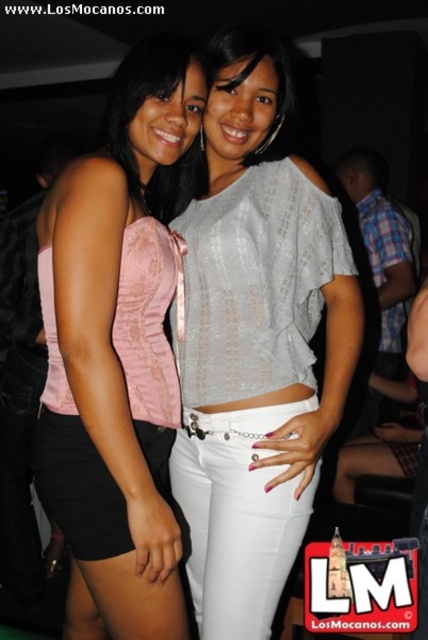
You are at a party and want to take a photo of both the light gray lace blouse at center and the pink satin top at left. Since you can only focus on one person at a time, which one should you aim the camera at to ensure the other is also in the frame?

You should aim the camera at the light gray lace blouse at center because it is positioned to the right of the pink satin top at left, so focusing on the center will include both in the frame.

You are a photographer at the event and need to adjust the lighting to ensure both the light gray lace blouse at center and the pink satin top at left are well lit. Based on their positions, which one might need more direct light to avoid shadows?

The light gray lace blouse at center is below the pink satin top at left, so it might need more direct light to avoid shadows caused by the top being above it.

You are a photographer at a social event. You want to take a closeup shot of the light gray lace blouse at center. Considering the camera focus range is 0.5 to 1 meter, will the blouse be in focus?

The light gray lace blouse at center is 1.12 meters away from camera, which is beyond the camera focus range of 0.5 to 1 meter. Therefore, the blouse will not be in focus.